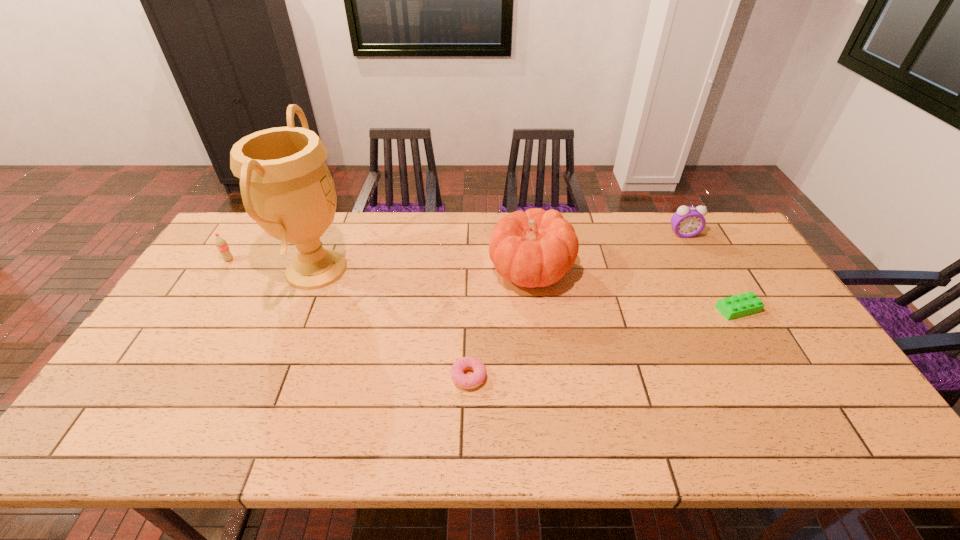
Find the location of `the tallest object`. the tallest object is located at coordinates (286, 187).

Locate an element on the screen. trophy is located at coordinates (286, 187).

You are a GUI agent. You are given a task and a screenshot of the screen. Output one action in this format:
    pyautogui.click(x=<x>, y=<y>)
    Task: Click on the fourth object from left to right
    
    Given the screenshot: What is the action you would take?
    pyautogui.click(x=536, y=248)

This screenshot has width=960, height=540. In order to click on pumpkin in this screenshot , I will do `click(536, 248)`.

You are a GUI agent. You are given a task and a screenshot of the screen. Output one action in this format:
    pyautogui.click(x=<x>, y=<y>)
    Task: Click on the alarm clock
    This screenshot has width=960, height=540.
    Given the screenshot: What is the action you would take?
    pyautogui.click(x=687, y=222)

Identify the location of the leftmost object. (221, 244).

At what (x,y) coordinates should I click in order to perform the action: click on Lego. Please return your answer as a coordinate pair (x, y). The image size is (960, 540). Looking at the image, I should click on (737, 306).

Where is `the nearest object`? The width and height of the screenshot is (960, 540). the nearest object is located at coordinates (471, 381).

Where is `the third object from left to right`? the third object from left to right is located at coordinates (471, 381).

You are a GUI agent. You are given a task and a screenshot of the screen. Output one action in this format:
    pyautogui.click(x=<x>, y=<y>)
    Task: Click on the vacant area situated 0.190m on the engravings side of the trophy
    This screenshot has height=540, width=960.
    Given the screenshot: What is the action you would take?
    pyautogui.click(x=414, y=269)